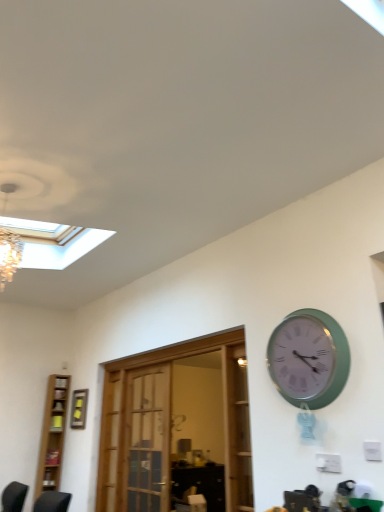
Question: Considering the positions of yellow matte picture frame at upper left and wooden door at center in the image, is yellow matte picture frame at upper left wider or thinner than wooden door at center?

Choices:
 (A) wide
 (B) thin

Answer: (B)

Question: Based on their positions, is yellow matte picture frame at upper left located to the left or right of wooden door at center?

Choices:
 (A) right
 (B) left

Answer: (B)

Question: Considering the real-world distances, which object is farthest from the wooden door at center?

Choices:
 (A) green plastic wall clock at upper right
 (B) light brown wooden bookshelf at left
 (C) yellow matte picture frame at upper left

Answer: (B)

Question: Which of these objects is positioned farthest from the green plastic wall clock at upper right?

Choices:
 (A) yellow matte picture frame at upper left
 (B) light brown wooden bookshelf at left
 (C) wooden door at center

Answer: (B)